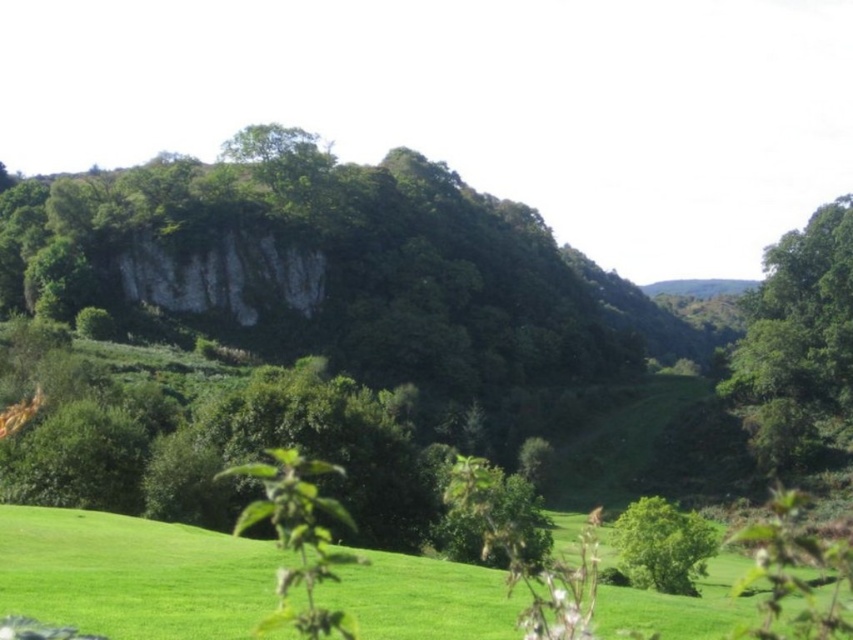
Based on the photo, you are planning to take a photo of the green leafy tree at upper right and the green leafy tree at center from the same distance. Which tree would appear wider in the photo?

The green leafy tree at upper right would appear wider in the photo because its width is larger than the green leafy tree at center.

You are standing at the origin point of the coordinate system. Which direction should you move to reach the green grassy field at lower center?

Since the green grassy field at lower center is located at coordinate point (132, 573), you should move towards the lower center direction to reach it.

You are standing in the middle of the green grassy field at lower center and want to reach the green leafy tree at upper right. Which direction should you walk to get closer to the tree?

To reach the green leafy tree at upper right from the green grassy field at lower center, you should walk towards the upper right direction since the tree is located in that direction relative to the field.